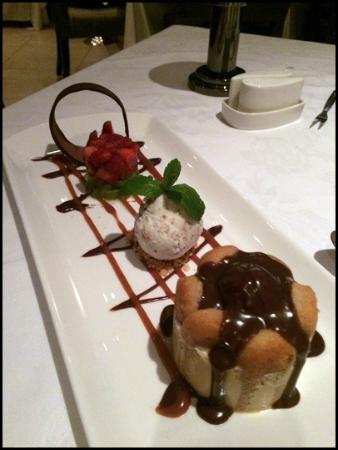
Identify the location of utensil. (323, 113).